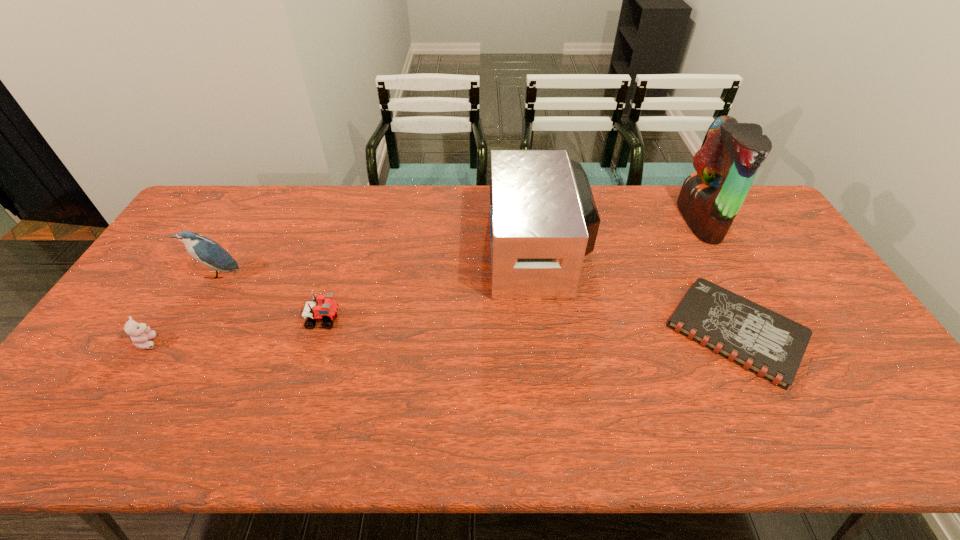
I want to click on free spot located 0.280m on the front-facing side of the fifth shortest object, so click(402, 250).

Find the location of a particular element. This screenshot has width=960, height=540. free spot located 0.150m on the front-facing side of the fifth shortest object is located at coordinates [x=444, y=250].

The height and width of the screenshot is (540, 960). What are the coordinates of `free region located 0.140m on the front-facing side of the fifth shortest object` in the screenshot? It's located at (446, 250).

The height and width of the screenshot is (540, 960). Identify the location of vacant space positioned 0.240m at the tip of the bird's beak. (174, 350).

Identify the location of free location located on the front-facing side of the Lego. tap(469, 320).

What are the coordinates of `free spot located 0.290m at the face of the teddy bear` in the screenshot? It's located at (270, 342).

Find the location of a particular element. This screenshot has height=540, width=960. free space located on the left of the shortest object is located at coordinates (529, 332).

Identify the location of parrot present at the far edge. The image size is (960, 540). (710, 198).

Identify the location of microwave oven that is at the far edge. (543, 218).

Image resolution: width=960 pixels, height=540 pixels. In order to click on bird positioned at the left edge in this screenshot , I will do `click(206, 251)`.